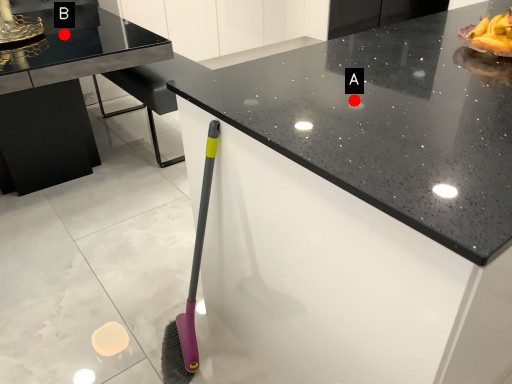
Question: Two points are circled on the image, labeled by A and B beside each circle. Which point is closer to the camera?

Choices:
 (A) A is closer
 (B) B is closer

Answer: (A)